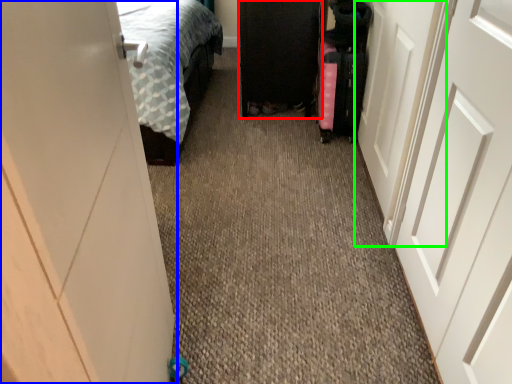
Question: Which is farther away from furniture (highlighted by a red box)? door (highlighted by a blue box) or door (highlighted by a green box)?

Choices:
 (A) door
 (B) door

Answer: (A)